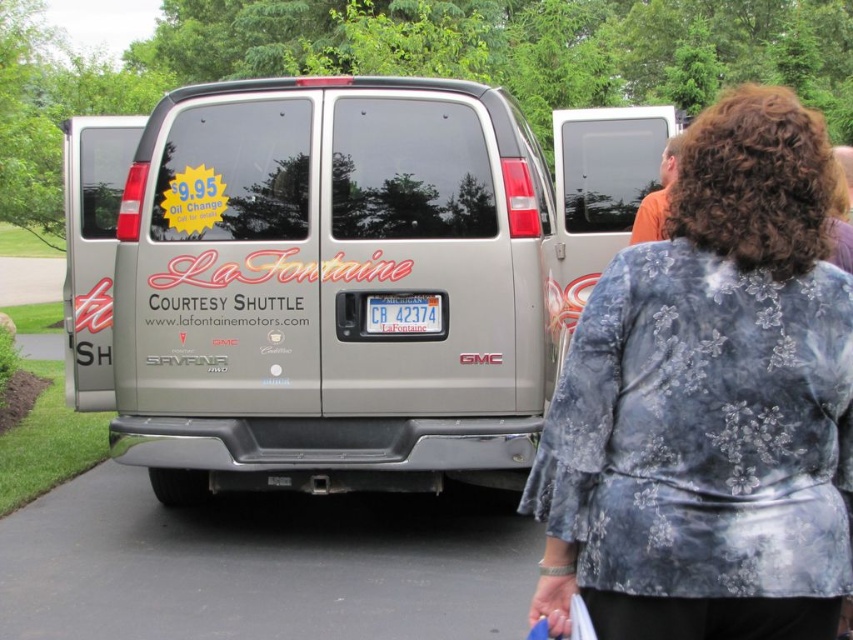
Question: Where is floral-patterned fabric at center located in relation to blue plastic license plate at center in the image?

Choices:
 (A) left
 (B) right

Answer: (B)

Question: Estimate the real-world distances between objects in this image. Which object is closer to the blue plastic license plate at center?

Choices:
 (A) silver metallic van at center
 (B) floral-patterned fabric at center

Answer: (A)

Question: Among these points, which one is farthest from the camera?

Choices:
 (A) (440, 224)
 (B) (399, 298)

Answer: (A)

Question: In this image, where is silver metallic van at center located relative to floral-patterned fabric at center?

Choices:
 (A) above
 (B) below

Answer: (A)

Question: Is silver metallic van at center to the left of blue plastic license plate at center from the viewer's perspective?

Choices:
 (A) yes
 (B) no

Answer: (A)

Question: Which is farther from the silver metallic van at center?

Choices:
 (A) blue plastic license plate at center
 (B) floral-patterned fabric at center

Answer: (B)